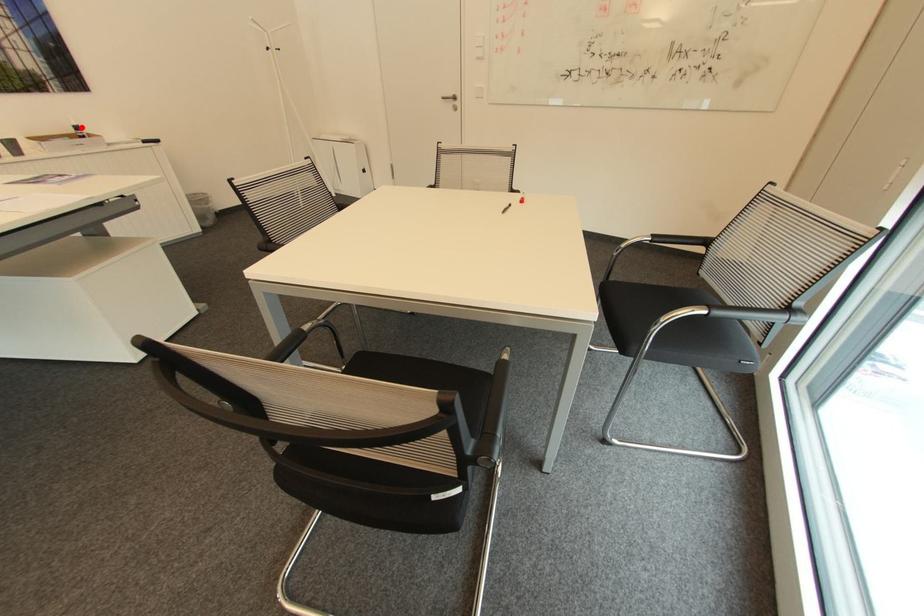
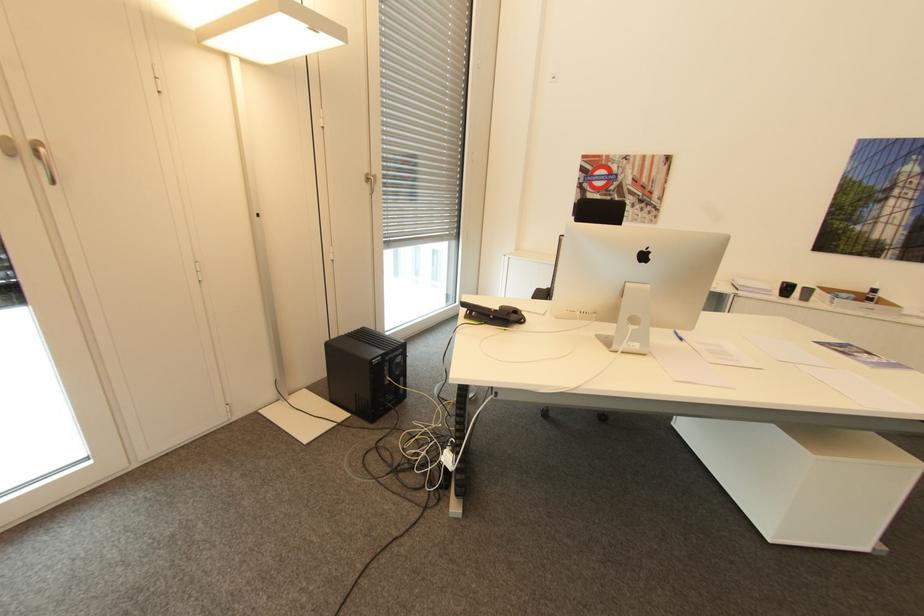
Question: I am providing you with two images of the same scene from different viewpoints. Given a red point in image1, look at the same physical point in image2. Is it:

Choices:
 (A) Closer to the viewpoint
 (B) Farther from the viewpoint

Answer: (A)